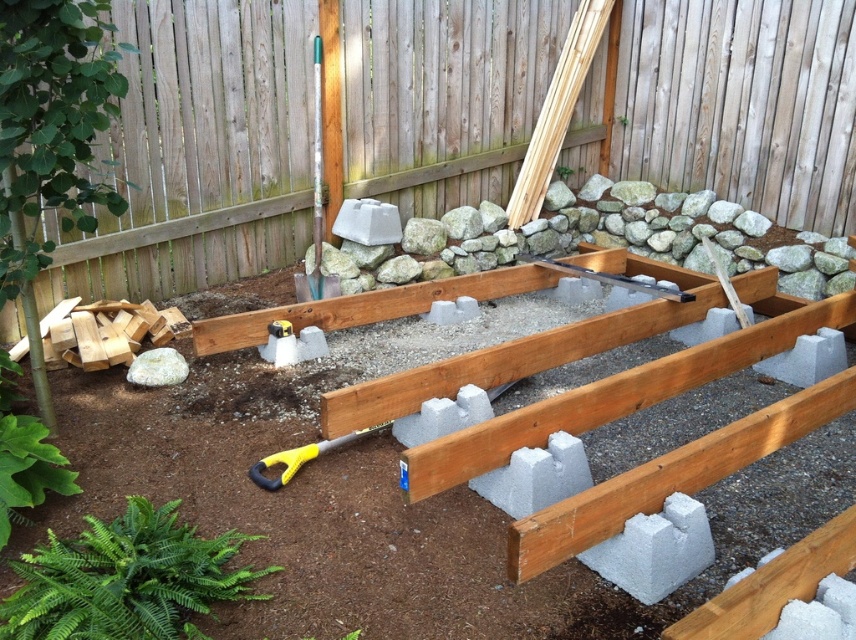
You are a construction worker standing at the origin point of the construction site. You need to place a new wooden beam at the same location as the wooden fence at upper center. What coordinates should you use?

The wooden fence at upper center is located at coordinates point (300, 128), so you should place the new wooden beam at coordinates point (300, 128).

You are standing at the construction site. There is a wooden fence at upper center marked by point (300, 128). Can you see the wooden fence at upper center from your current position?

Yes, the wooden fence at upper center is marked by point (300, 128), so it is visible from your current position.